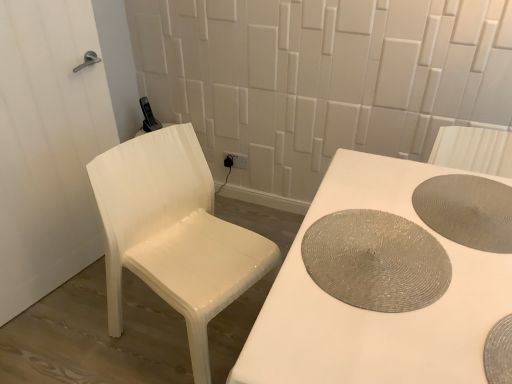
Question: Could you tell me if white glossy door at left is turned towards silver textured placemat at bottom right, which is counted as the third manhole cover, starting from the back?

Choices:
 (A) no
 (B) yes

Answer: (B)

Question: Is white glossy door at left in contact with silver textured placemat at bottom right, acting as the first manhole cover starting from the front?

Choices:
 (A) yes
 (B) no

Answer: (B)

Question: Considering the relative sizes of white glossy door at left and silver textured placemat at bottom right, acting as the first manhole cover starting from the front, in the image provided, is white glossy door at left taller than silver textured placemat at bottom right, acting as the first manhole cover starting from the front,?

Choices:
 (A) yes
 (B) no

Answer: (A)

Question: From a real-world perspective, is white glossy door at left located beneath silver textured placemat at bottom right, which is counted as the third manhole cover, starting from the back?

Choices:
 (A) no
 (B) yes

Answer: (B)

Question: From a real-world perspective, is white glossy door at left on silver textured placemat at bottom right, which is counted as the third manhole cover, starting from the back?

Choices:
 (A) yes
 (B) no

Answer: (B)

Question: From a real-world perspective, relative to white glossy chair at left, is matte gray placemat at right, the 3th manhole cover from the front, vertically above or below?

Choices:
 (A) above
 (B) below

Answer: (A)

Question: Considering the positions of matte gray placemat at right, the 1th manhole cover when ordered from back to front, and white glossy chair at left in the image, is matte gray placemat at right, the 1th manhole cover when ordered from back to front, taller or shorter than white glossy chair at left?

Choices:
 (A) tall
 (B) short

Answer: (B)

Question: Considering their positions, is matte gray placemat at right, the 3th manhole cover from the front, located in front of or behind white glossy chair at left?

Choices:
 (A) behind
 (B) front

Answer: (B)

Question: Considering the positions of matte gray placemat at right, the 3th manhole cover from the front, and white glossy chair at left in the image, is matte gray placemat at right, the 3th manhole cover from the front, bigger or smaller than white glossy chair at left?

Choices:
 (A) big
 (B) small

Answer: (B)

Question: Which is correct: shiny metallic placemat at table right, placed as the 2th manhole cover when sorted from front to back, is inside matte gray placemat at right, the 3th manhole cover from the front, or outside of it?

Choices:
 (A) outside
 (B) inside

Answer: (A)

Question: Based on their positions, is shiny metallic placemat at table right, placed as the 2th manhole cover when sorted from front to back, located to the left or right of matte gray placemat at right, the 3th manhole cover from the front?

Choices:
 (A) left
 (B) right

Answer: (A)

Question: Considering the positions of shiny metallic placemat at table right, placed as the 2th manhole cover when sorted from front to back, and matte gray placemat at right, the 3th manhole cover from the front, in the image, is shiny metallic placemat at table right, placed as the 2th manhole cover when sorted from front to back, taller or shorter than matte gray placemat at right, the 3th manhole cover from the front,?

Choices:
 (A) tall
 (B) short

Answer: (B)

Question: Considering the positions of shiny metallic placemat at table right, placed as the 2th manhole cover when sorted from front to back, and matte gray placemat at right, the 1th manhole cover when ordered from back to front, in the image, is shiny metallic placemat at table right, placed as the 2th manhole cover when sorted from front to back, bigger or smaller than matte gray placemat at right, the 1th manhole cover when ordered from back to front,?

Choices:
 (A) small
 (B) big

Answer: (A)

Question: In terms of width, does silver textured placemat at bottom right, acting as the first manhole cover starting from the front, look wider or thinner when compared to white glossy door at left?

Choices:
 (A) thin
 (B) wide

Answer: (B)

Question: Is silver textured placemat at bottom right, acting as the first manhole cover starting from the front, to the left or to the right of white glossy door at left in the image?

Choices:
 (A) left
 (B) right

Answer: (B)